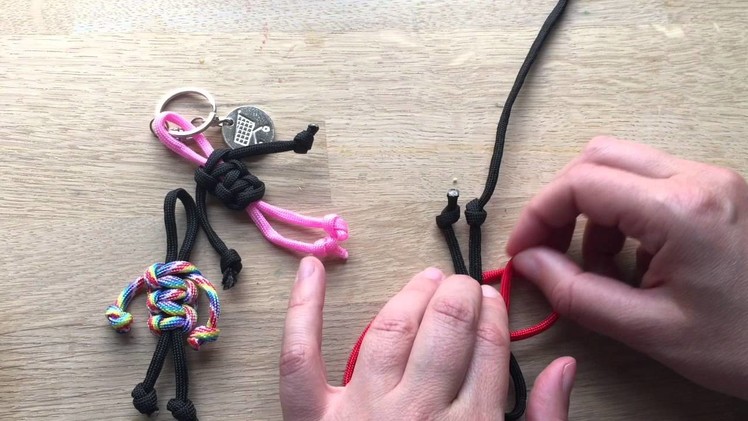
You are a GUI agent. You are given a task and a screenshot of the screen. Output one action in this format:
    pyautogui.click(x=<x>, y=<y>)
    Task: Click on the wooden table
    The height and width of the screenshot is (421, 748).
    Given the screenshot: What is the action you would take?
    pyautogui.click(x=392, y=79)